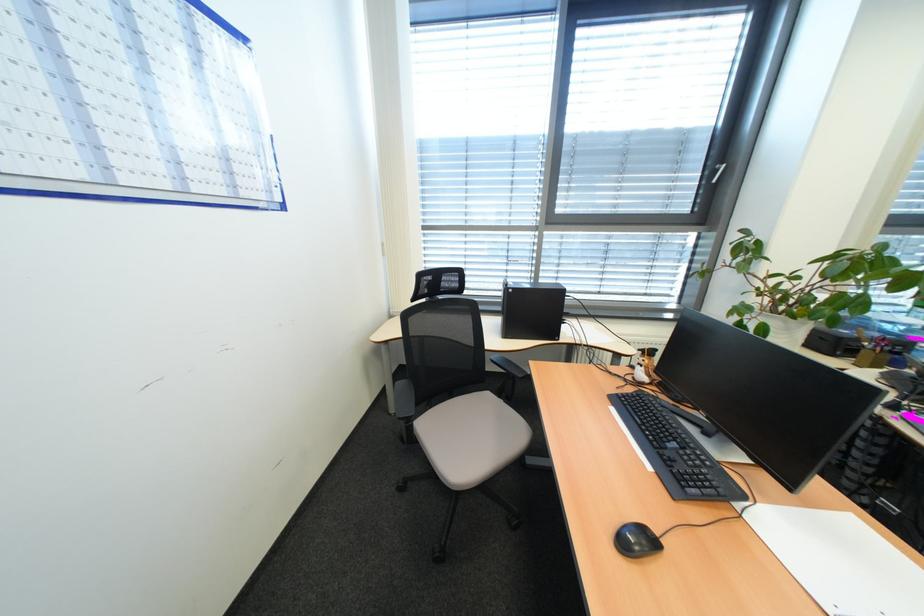
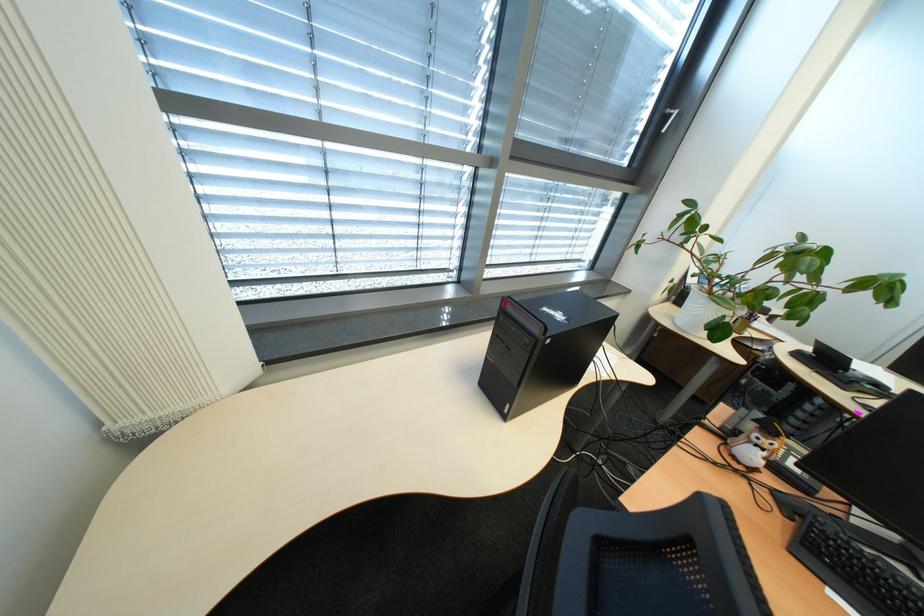
Question: I am providing you with two images of the same scene from different viewpoints. Which of the following objects are not visible in image2?

Choices:
 (A) small owl figurine
 (B) computer power button
 (C) white flower pot
 (D) none of these

Answer: (D)